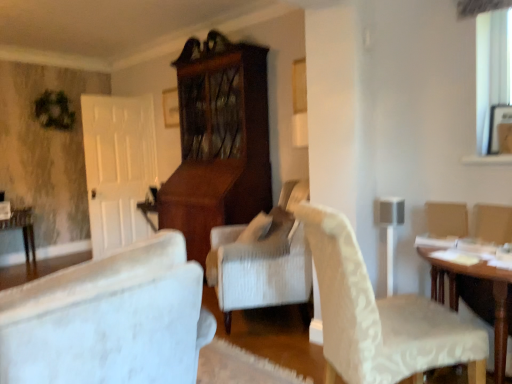
Question: Does wooden table at lower left, which is counted as the 1th table, starting from the left, appear on the right side of white textured chair at center-right?

Choices:
 (A) yes
 (B) no

Answer: (B)

Question: Could you tell me if wooden table at lower left, marked as the 2th table in a front-to-back arrangement, is facing white textured chair at center-right?

Choices:
 (A) yes
 (B) no

Answer: (A)

Question: Is wooden table at lower left, arranged as the second table when viewed from the right, at the left side of white textured chair at center-right?

Choices:
 (A) yes
 (B) no

Answer: (A)

Question: From the image's perspective, is wooden table at lower left, marked as the 2th table in a front-to-back arrangement, on top of white textured chair at center-right?

Choices:
 (A) no
 (B) yes

Answer: (A)

Question: Does wooden table at lower left, arranged as the second table when viewed from the right, have a lesser width compared to white textured chair at center-right?

Choices:
 (A) yes
 (B) no

Answer: (A)

Question: From their relative heights in the image, would you say white textured chair at center-right is taller or shorter than wooden table at lower left, placed as the 1th table when sorted from back to front?

Choices:
 (A) tall
 (B) short

Answer: (A)

Question: Is white textured chair at center-right to the left or to the right of wooden table at lower left, placed as the 1th table when sorted from back to front, in the image?

Choices:
 (A) left
 (B) right

Answer: (B)

Question: Relative to wooden table at lower left, arranged as the second table when viewed from the right, is white textured chair at center-right in front or behind?

Choices:
 (A) front
 (B) behind

Answer: (A)

Question: Is white textured chair at center-right spatially inside wooden table at lower left, placed as the 1th table when sorted from back to front, or outside of it?

Choices:
 (A) inside
 (B) outside

Answer: (B)

Question: Is point (501, 327) closer or farther from the camera than point (10, 221)?

Choices:
 (A) closer
 (B) farther

Answer: (A)

Question: Is wooden table at right, the first table when ordered from front to back, taller or shorter than wooden table at lower left, marked as the 2th table in a front-to-back arrangement?

Choices:
 (A) tall
 (B) short

Answer: (A)

Question: Based on their positions, is wooden table at right, which is counted as the first table, starting from the right, located to the left or right of wooden table at lower left, marked as the 2th table in a front-to-back arrangement?

Choices:
 (A) left
 (B) right

Answer: (B)

Question: In the image, is wooden table at right, the first table when ordered from front to back, positioned in front of or behind wooden table at lower left, arranged as the second table when viewed from the right?

Choices:
 (A) behind
 (B) front

Answer: (B)

Question: Would you say white textured chair at center-right is to the left or to the right of wooden table at right, acting as the second table starting from the back, in the picture?

Choices:
 (A) right
 (B) left

Answer: (B)

Question: In terms of width, does white textured chair at center-right look wider or thinner when compared to wooden table at right, the first table when ordered from front to back?

Choices:
 (A) thin
 (B) wide

Answer: (A)